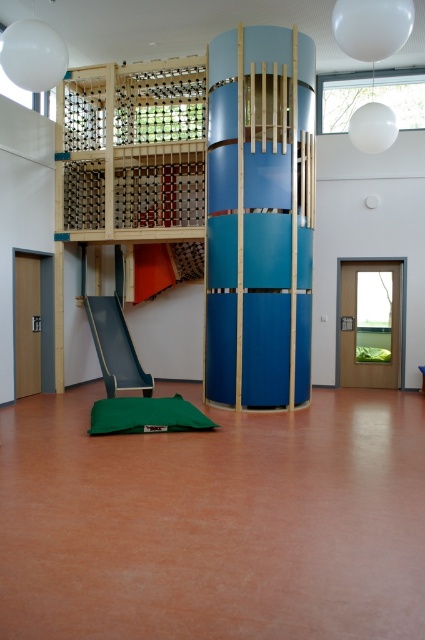
Question: Based on their relative distances, which object is farther from the wooden bunk bed at left?

Choices:
 (A) green fabric mat at center
 (B) teal glossy slide at lower left
 (C) blue glossy pillar at center

Answer: (A)

Question: Which point is farther from the camera taking this photo?

Choices:
 (A) (260, 285)
 (B) (243, 237)

Answer: (A)

Question: Estimate the real-world distances between objects in this image. Which object is closer to the green fabric mat at center?

Choices:
 (A) wooden bunk bed at left
 (B) teal glossy slide at lower left

Answer: (B)

Question: Observing the image, what is the correct spatial positioning of blue glossy pillar at center in reference to teal glossy slide at lower left?

Choices:
 (A) right
 (B) left

Answer: (A)

Question: Does wooden bunk bed at left come in front of teal glossy slide at lower left?

Choices:
 (A) no
 (B) yes

Answer: (B)

Question: Is blue glossy pillar at center bigger than green fabric mat at center?

Choices:
 (A) yes
 (B) no

Answer: (A)